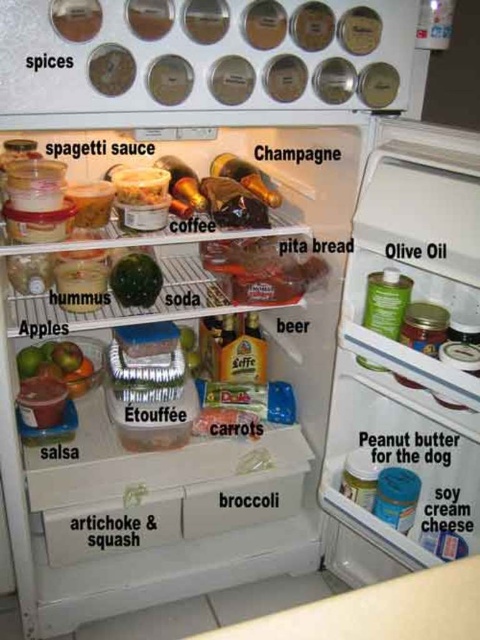
Is point (37, 365) farther from camera compared to point (115, 276)?

Yes, point (37, 365) is behind point (115, 276).

Does point (70, 380) come farther from viewer compared to point (112, 275)?

Yes, point (70, 380) is behind point (112, 275).

At what (x,y) coordinates should I click in order to perform the action: click on green matte apples at lower left. Please return your answer as a coordinate pair (x, y). The height and width of the screenshot is (640, 480). Looking at the image, I should click on (58, 364).